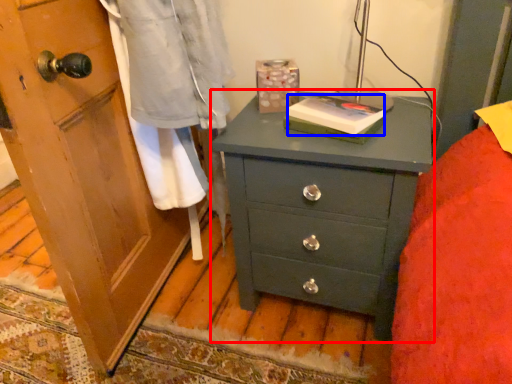
Question: Which of the following is the farthest to the observer, chest of drawers (highlighted by a red box) or book (highlighted by a blue box)?

Choices:
 (A) chest of drawers
 (B) book

Answer: (B)